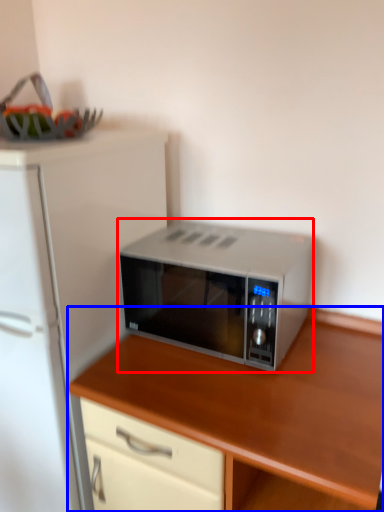
Question: Which point is closer to the camera, microwave oven (highlighted by a red box) or cabinetry (highlighted by a blue box)?

Choices:
 (A) microwave oven
 (B) cabinetry

Answer: (B)